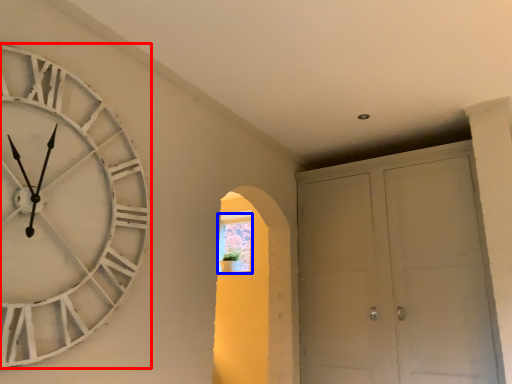
Question: Which object appears farthest to the camera in this image, wall clock (highlighted by a red box) or window (highlighted by a blue box)?

Choices:
 (A) wall clock
 (B) window

Answer: (B)